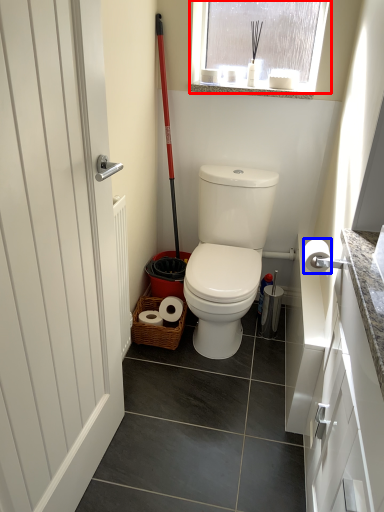
Question: Which object appears closest to the camera in this image, window (highlighted by a red box) or toilet paper (highlighted by a blue box)?

Choices:
 (A) window
 (B) toilet paper

Answer: (B)